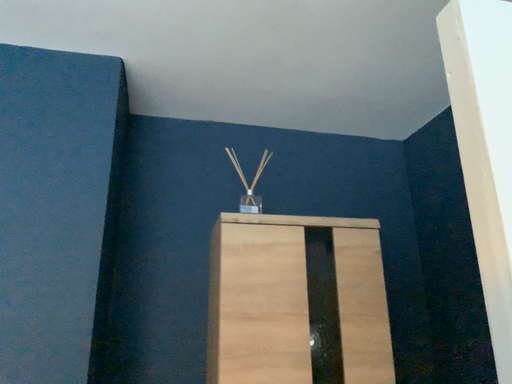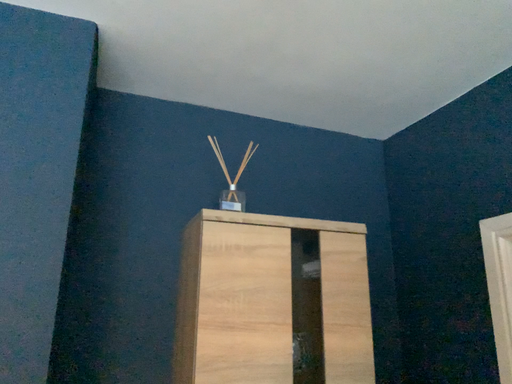
Question: How did the camera likely rotate when shooting the video?

Choices:
 (A) rotated left
 (B) rotated right

Answer: (B)